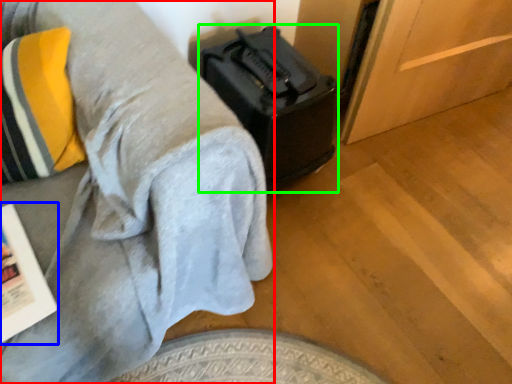
Question: Based on their relative distances, which object is farther from furniture (highlighted by a red box)? Choose from magazine (highlighted by a blue box) and luggage (highlighted by a green box).

Choices:
 (A) magazine
 (B) luggage

Answer: (B)